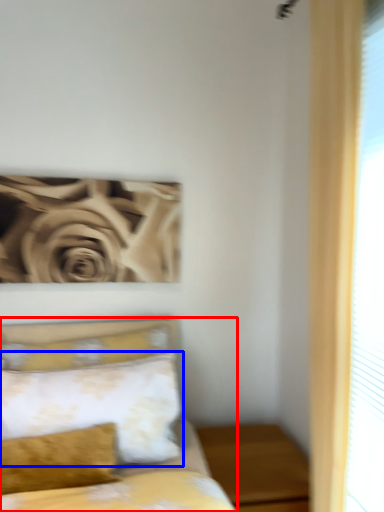
Question: Which object is closer to the camera taking this photo, bed (highlighted by a red box) or pillow (highlighted by a blue box)?

Choices:
 (A) bed
 (B) pillow

Answer: (A)